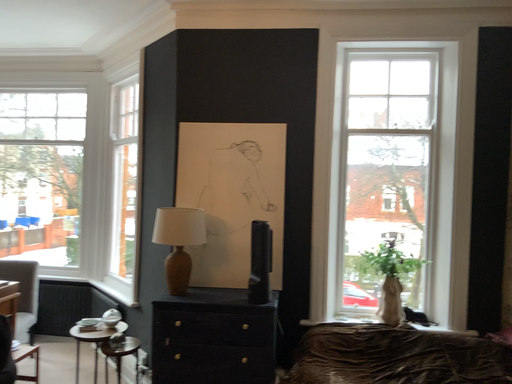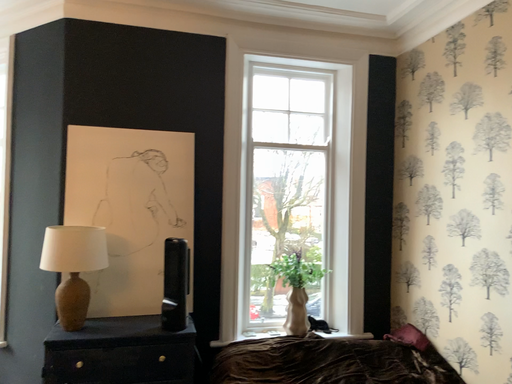
Question: How did the camera likely rotate when shooting the video?

Choices:
 (A) rotated right
 (B) rotated left

Answer: (A)